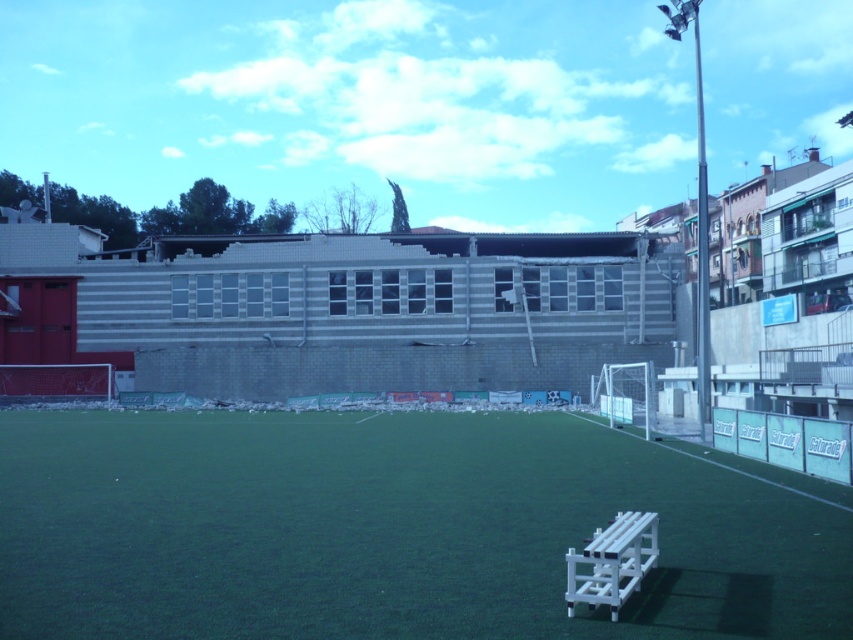
Can you confirm if green artificial turf at center is smaller than white plastic bench at lower right?

Incorrect, green artificial turf at center is not smaller in size than white plastic bench at lower right.

Who is lower down, green artificial turf at center or white plastic bench at lower right?

green artificial turf at center is lower down.

Does point (169, 502) come farther from viewer compared to point (618, 525)?

That is True.

Locate an element on the screen. green artificial turf at center is located at coordinates (390, 531).